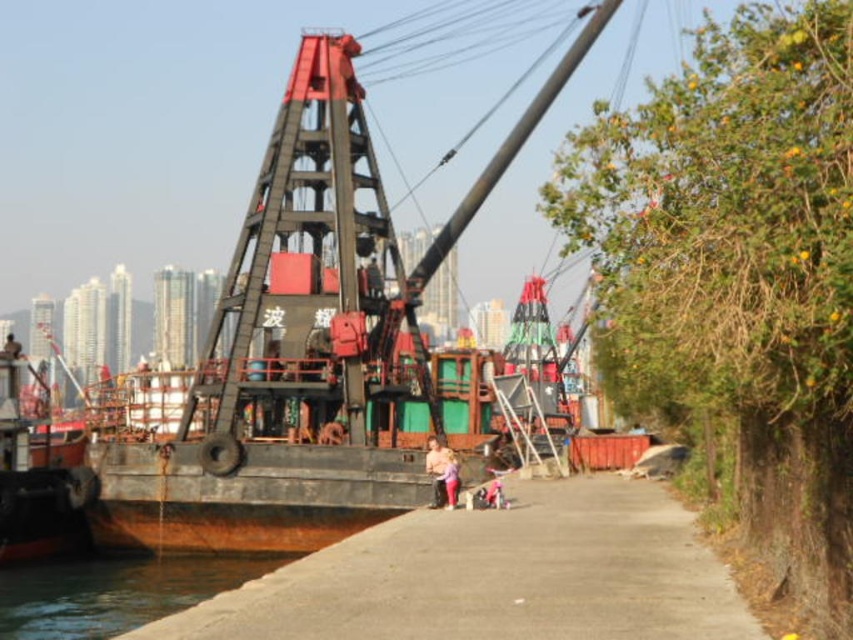
Question: Is rusty metal crane at center above matte pink pants at center?

Choices:
 (A) no
 (B) yes

Answer: (B)

Question: Can you confirm if clear water at lower left is positioned below matte pink pants at center?

Choices:
 (A) yes
 (B) no

Answer: (A)

Question: Is concrete sidewalk at center above matte pink pants at center?

Choices:
 (A) no
 (B) yes

Answer: (A)

Question: Considering the real-world distances, which object is farthest from the rusty metal crane at center?

Choices:
 (A) concrete sidewalk at center
 (B) clear water at lower left

Answer: (A)

Question: Which object is closer to the camera taking this photo?

Choices:
 (A) rusty metal crane at center
 (B) pink fabric pants at lower center

Answer: (B)

Question: Which of the following is the closest to the observer?

Choices:
 (A) pink fabric pants at lower center
 (B) matte pink pants at center
 (C) rusty metal crane at center

Answer: (A)